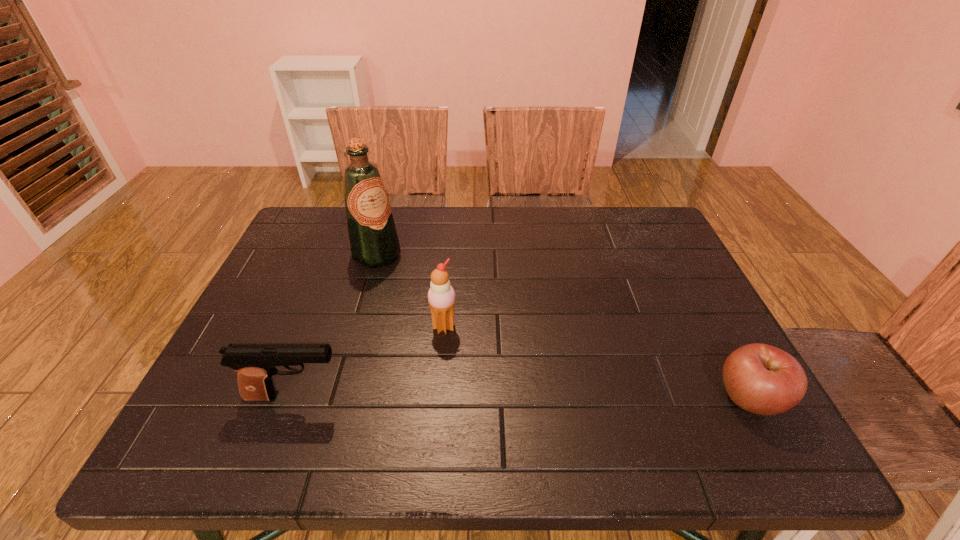
Where is `the second shortest object`? The image size is (960, 540). the second shortest object is located at coordinates (255, 363).

Identify the location of apple. (762, 379).

At what (x,y) coordinates should I click in order to perform the action: click on the rightmost object. Please return your answer as a coordinate pair (x, y). The width and height of the screenshot is (960, 540). Looking at the image, I should click on [x=762, y=379].

Where is `icecream`? The height and width of the screenshot is (540, 960). icecream is located at coordinates (441, 296).

At what (x,y) coordinates should I click in order to perform the action: click on the second object from right to left. Please return your answer as a coordinate pair (x, y). Looking at the image, I should click on (441, 296).

Find the location of a particular element. The image size is (960, 540). the tallest object is located at coordinates (374, 242).

Locate an element on the screen. The width and height of the screenshot is (960, 540). olive oil is located at coordinates [x=374, y=242].

This screenshot has width=960, height=540. I want to click on vacant space located 0.370m at the barrel of the second shortest object, so click(524, 396).

Locate an element on the screen. Image resolution: width=960 pixels, height=540 pixels. free space located at the front with a straw on the second object from right to left is located at coordinates (511, 394).

Find the location of a particular element. The width and height of the screenshot is (960, 540). vacant region located at the front with a straw on the second object from right to left is located at coordinates (487, 369).